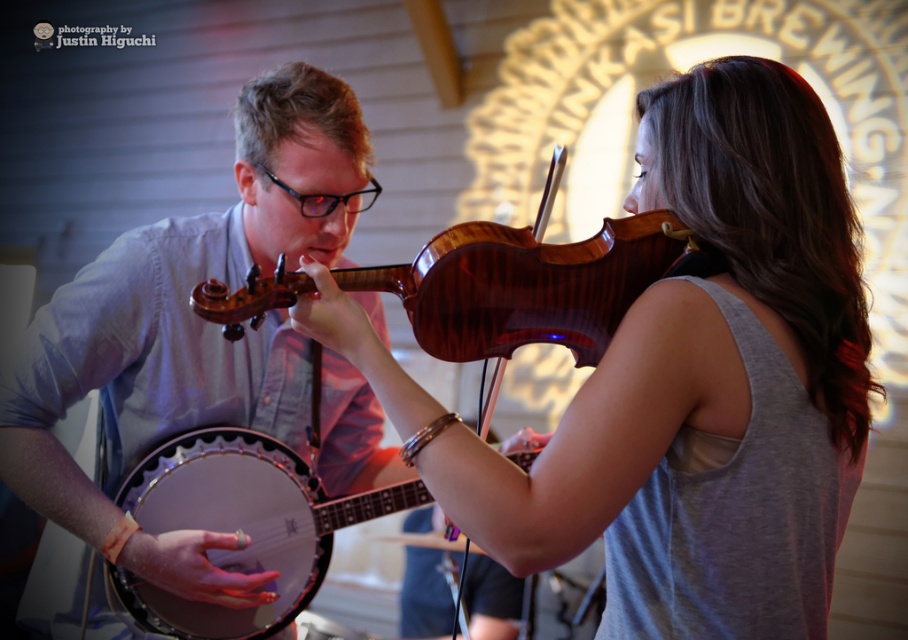
You are a photographer at the event and want to capture a photo of both the wooden violin at center and the matte blue shirt at left. Based on their positions, which object should you focus on first to ensure both are in the frame?

The wooden violin at center is positioned on the right side of matte blue shirt at left. To include both in the frame, focus on the matte blue shirt at left first, then adjust to ensure the wooden violin at center on its right is also captured.

Looking at this image, you are a photographer setting up for a concert photo shoot. You need to adjust the height of the camera stand to capture both the wooden violin at center and the matte brown banjo at center in focus. Which instrument should you adjust the stand height to match?

The wooden violin at center is taller than the matte brown banjo at center, so you should adjust the camera stand height to match the wooden violin at center to ensure both are in focus.